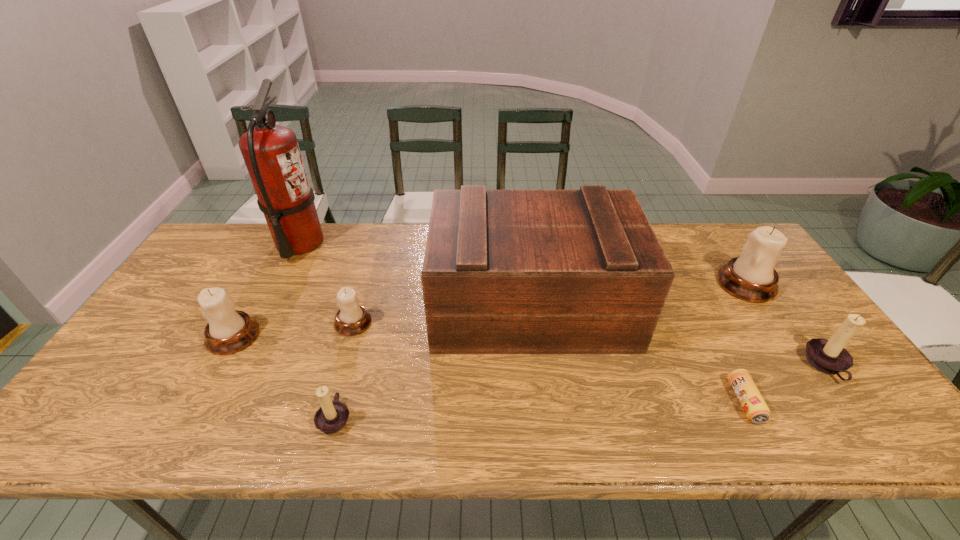
Locate an element on the screen. vacant space at the right edge is located at coordinates (765, 318).

Locate an element on the screen. vacant space at the far left corner of the desktop is located at coordinates (203, 254).

Image resolution: width=960 pixels, height=540 pixels. I want to click on vacant space at the near left corner, so click(x=132, y=436).

This screenshot has height=540, width=960. I want to click on vacant area that lies between the smaller brown candle holder and the second tallest object, so click(433, 362).

You are a GUI agent. You are given a task and a screenshot of the screen. Output one action in this format:
    pyautogui.click(x=<x>, y=<y>)
    Task: Click on the free spot between the left brown candle holder and the tallest object
    
    Given the screenshot: What is the action you would take?
    pyautogui.click(x=317, y=330)

Find the location of a particular element. vacant area that lies between the red fire extinguisher and the leftmost candle holder is located at coordinates (266, 289).

Find the location of `free spot between the fire extinguisher and the second biggest white candle holder`. free spot between the fire extinguisher and the second biggest white candle holder is located at coordinates (266, 289).

Find the location of a particular element. The height and width of the screenshot is (540, 960). unoccupied position between the beer can and the leftmost candle holder is located at coordinates (489, 369).

I want to click on free space that is in between the left brown candle holder and the right brown candle holder, so click(x=581, y=392).

Locate an element on the screen. the fifth closest object to the fourth object from right to left is located at coordinates (829, 356).